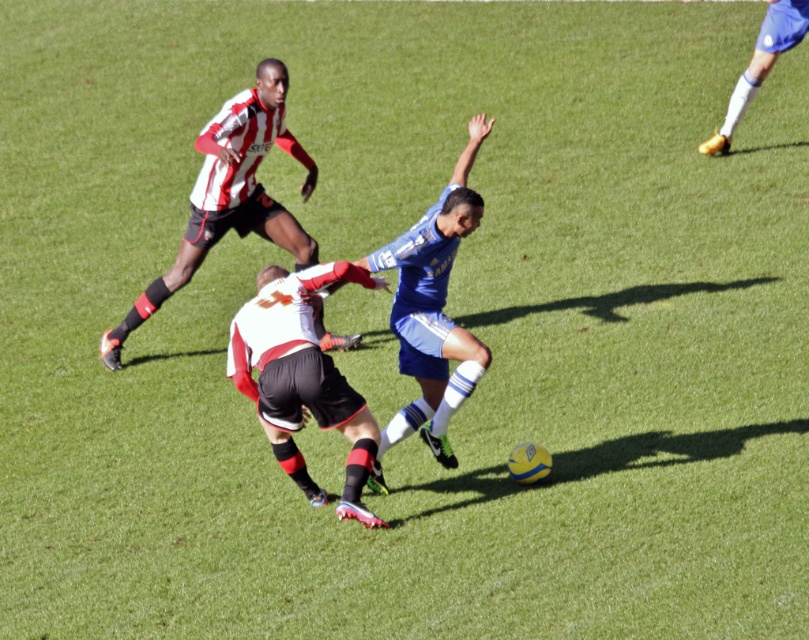
Question: Observing the image, what is the correct spatial positioning of white matte soccer cleat at lower center in reference to blue matte jersey at center?

Choices:
 (A) below
 (B) above

Answer: (A)

Question: Does blue matte jersey at center appear on the right side of gold metallic boot at upper right?

Choices:
 (A) no
 (B) yes

Answer: (A)

Question: Estimate the real-world distances between objects in this image. Which object is closer to the gold metallic boot at upper right?

Choices:
 (A) white matte soccer cleat at lower center
 (B) blue matte jersey at center

Answer: (B)

Question: Which object is closer to the camera taking this photo?

Choices:
 (A) gold metallic boot at upper right
 (B) striped jersey at upper left
 (C) white matte soccer cleat at lower center
 (D) blue matte jersey at center

Answer: (C)

Question: Is striped jersey at upper left wider than gold metallic boot at upper right?

Choices:
 (A) no
 (B) yes

Answer: (B)

Question: Which point appears closest to the camera in this image?

Choices:
 (A) (424, 221)
 (B) (282, 268)
 (C) (765, 44)
 (D) (310, 188)

Answer: (A)